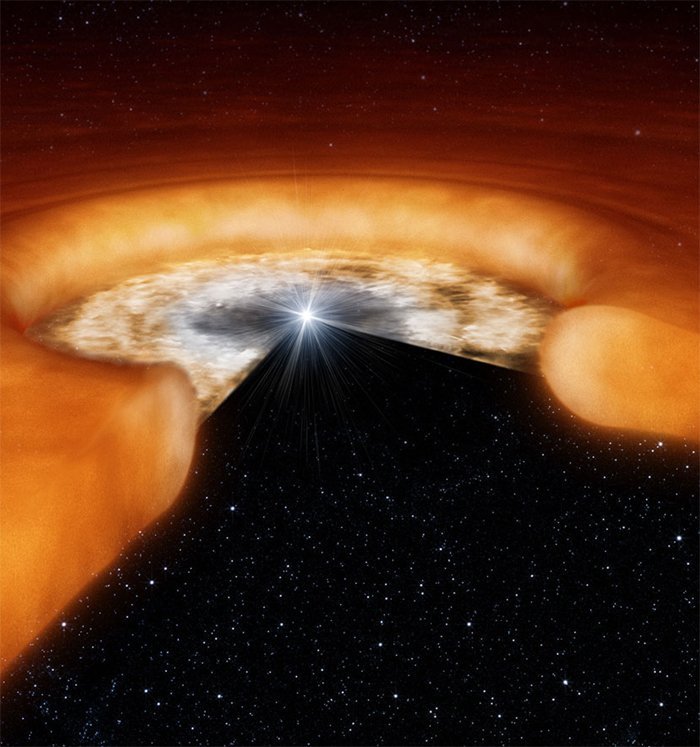
At what (x,y) coordinates should I click in order to perform the action: click on light. Please return your answer as a coordinate pair (x, y). Looking at the image, I should click on (313, 319).